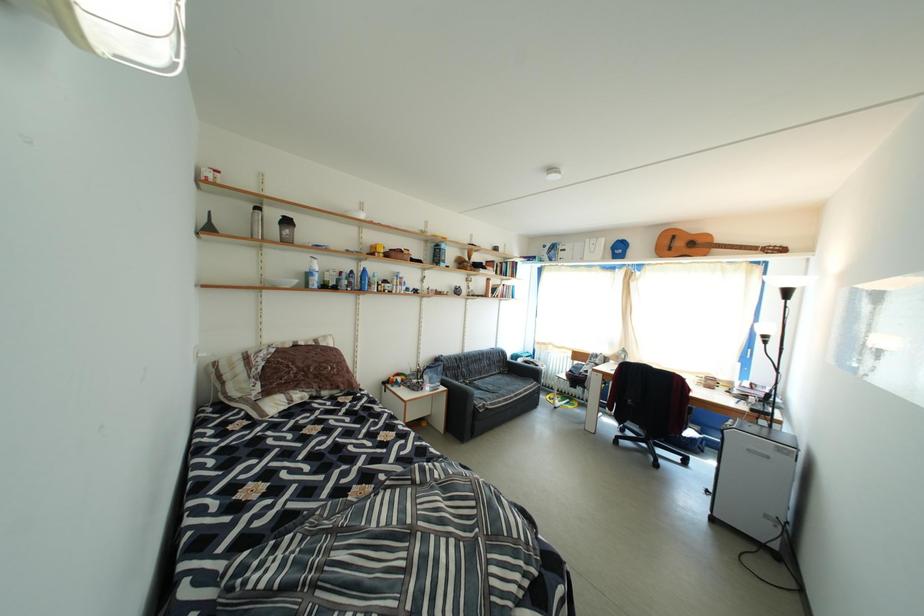
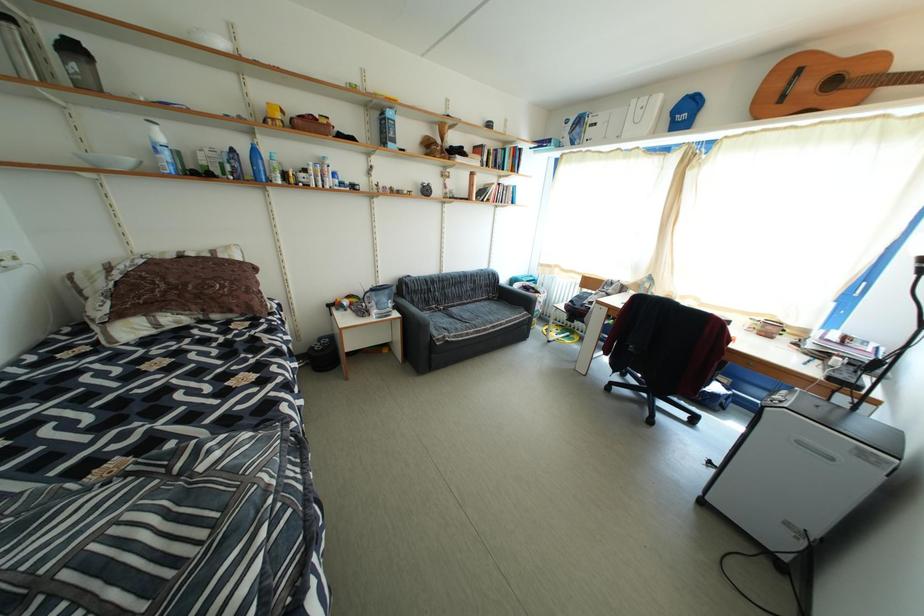
Question: The first image is from the beginning of the video and the second image is from the end. How did the camera likely rotate when shooting the video?

Choices:
 (A) Left
 (B) Right
 (C) Up
 (D) Down

Answer: (D)